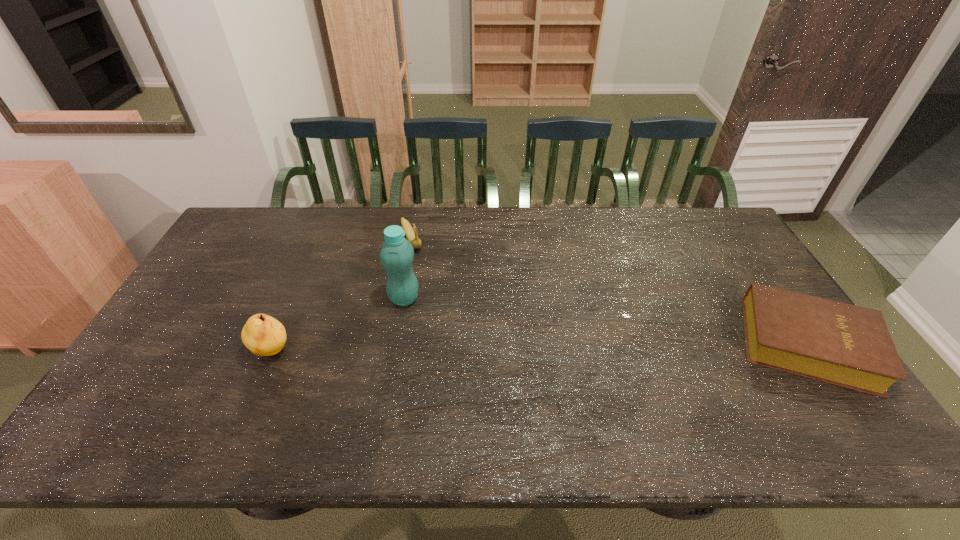
I want to click on free spot between the leftmost object and the rightmost object, so click(540, 348).

Locate an element on the screen. The image size is (960, 540). free space that is in between the leftmost object and the rightmost object is located at coordinates point(540,348).

The image size is (960, 540). What are the coordinates of `vacant region between the shortest object and the pear` in the screenshot? It's located at (540, 348).

The height and width of the screenshot is (540, 960). Identify the location of vacant space that is in between the tallest object and the rightmost object. (606, 321).

At what (x,y) coordinates should I click in order to perform the action: click on vacant space that's between the Bible and the water bottle. Please return your answer as a coordinate pair (x, y). Looking at the image, I should click on (606, 321).

Find the location of a particular element. This screenshot has width=960, height=540. object that can be found as the third closest to the water bottle is located at coordinates (842, 344).

Identify the location of object that ranks as the second closest to the banana. (263, 335).

You are a GUI agent. You are given a task and a screenshot of the screen. Output one action in this format:
    pyautogui.click(x=<x>, y=<y>)
    Task: Click on the free space that satisfies the following two spatial constraints: 1. on the back side of the water bottle; 2. on the right side of the third shortest object
    This screenshot has height=540, width=960.
    Given the screenshot: What is the action you would take?
    pyautogui.click(x=295, y=298)

Locate an element on the screen. The width and height of the screenshot is (960, 540). vacant space that satisfies the following two spatial constraints: 1. on the front side of the banana; 2. on the left side of the tallest object is located at coordinates (400, 298).